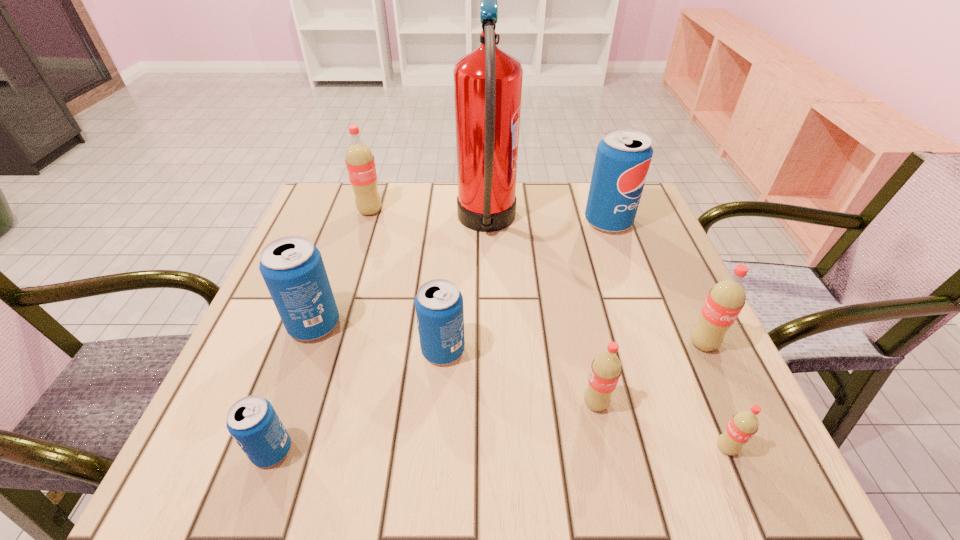
Find the location of a particular element. The height and width of the screenshot is (540, 960). vacant region between the leftmost red soda and the red fire extinguisher is located at coordinates (428, 218).

Where is `vacant area between the third biggest red soda and the rightmost blue soda can`? This screenshot has width=960, height=540. vacant area between the third biggest red soda and the rightmost blue soda can is located at coordinates (602, 313).

At what (x,y) coordinates should I click in order to perform the action: click on object that ranks as the second closest to the nearest blue soda can. Please return your answer as a coordinate pair (x, y). Looking at the image, I should click on (439, 310).

This screenshot has width=960, height=540. I want to click on the second closest object to the biggest blue soda can, so click(x=726, y=298).

Locate an element on the screen. Image resolution: width=960 pixels, height=540 pixels. the third closest soda relative to the second biggest blue soda can is located at coordinates (360, 163).

Locate an element on the screen. The image size is (960, 540). soda that stands as the seventh closest to the smallest red soda is located at coordinates (360, 163).

You are a GUI agent. You are given a task and a screenshot of the screen. Output one action in this format:
    pyautogui.click(x=<x>, y=<y>)
    Task: Click on the closest blue soda can to the third smallest blue soda can
    
    Given the screenshot: What is the action you would take?
    pyautogui.click(x=439, y=310)

You are a GUI agent. You are given a task and a screenshot of the screen. Output one action in this format:
    pyautogui.click(x=<x>, y=<y>)
    Task: Click on the blue soda can that is the closest to the nearest red soda
    
    Given the screenshot: What is the action you would take?
    pyautogui.click(x=439, y=310)

Locate an element on the screen. red soda that is the second nearest to the farthest red soda is located at coordinates (726, 298).

Point out which red soda is positioned as the third nearest to the third nearest red soda. Please provide its 2D coordinates. Your answer should be formatted as a tuple, i.e. [(x, y)], where the tuple contains the x and y coordinates of a point satisfying the conditions above.

[(360, 163)]